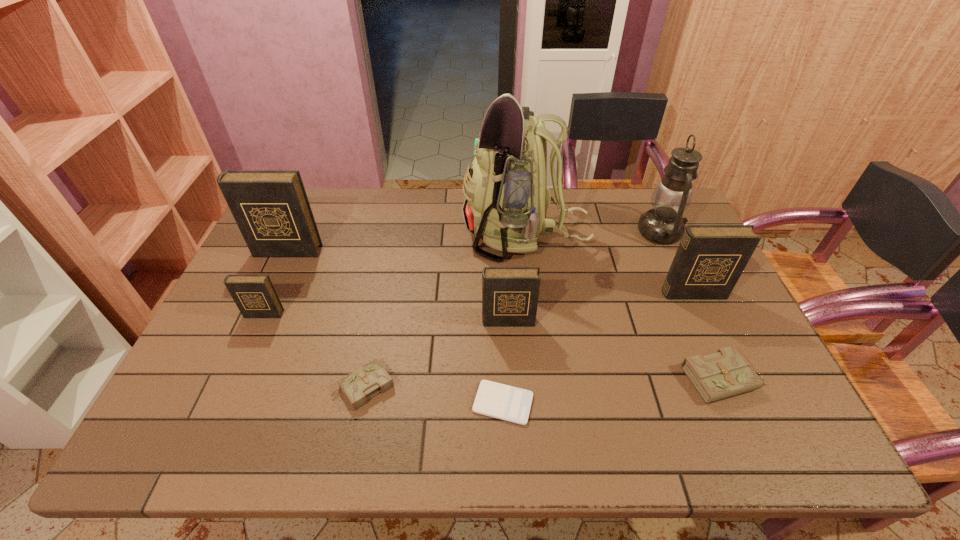
Where is `empty location between the third object from left to right and the third diary from right to left`? empty location between the third object from left to right and the third diary from right to left is located at coordinates (436, 354).

Find the location of a particular element. Image resolution: width=960 pixels, height=540 pixels. vacant area that lies between the third biggest dark diary and the fifth shortest diary is located at coordinates pos(601,307).

You are a GUI agent. You are given a task and a screenshot of the screen. Output one action in this format:
    pyautogui.click(x=<x>, y=<y>)
    Task: Click on the vacant region between the calculator and the second dark diary from right to left
    The image size is (960, 540).
    Given the screenshot: What is the action you would take?
    pyautogui.click(x=506, y=362)

Find the location of a particular element. This screenshot has width=960, height=540. free spot between the calculator and the smallest dark diary is located at coordinates (383, 359).

Find the location of a particular element. The image size is (960, 540). object that stands as the eighth closest to the white calculator is located at coordinates (271, 208).

Find the location of `object that is the fourth closest to the backpack`. object that is the fourth closest to the backpack is located at coordinates (726, 373).

Locate which diary ranks fourth in proximity to the oil lamp. Please provide its 2D coordinates. Your answer should be formatted as a tuple, i.e. [(x, y)], where the tuple contains the x and y coordinates of a point satisfying the conditions above.

[(367, 381)]

The width and height of the screenshot is (960, 540). Find the location of `diary that is the third nearest to the third biggest dark diary`. diary that is the third nearest to the third biggest dark diary is located at coordinates (710, 259).

What are the coordinates of `dark diary object that ranks as the closest to the fourth diary from left to right` in the screenshot? It's located at (710, 259).

Choose which dark diary is the third nearest neighbor to the second shortest object. Please provide its 2D coordinates. Your answer should be formatted as a tuple, i.e. [(x, y)], where the tuple contains the x and y coordinates of a point satisfying the conditions above.

[(271, 208)]